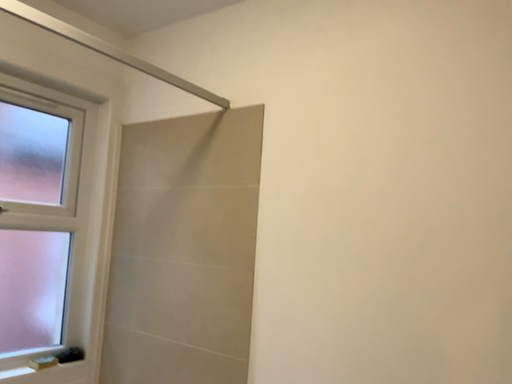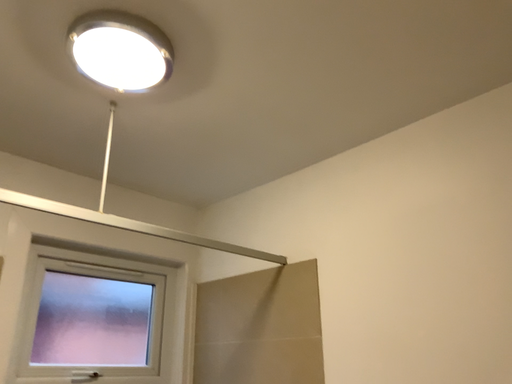
Question: Which way did the camera rotate in the video?

Choices:
 (A) rotated downward
 (B) rotated upward

Answer: (B)